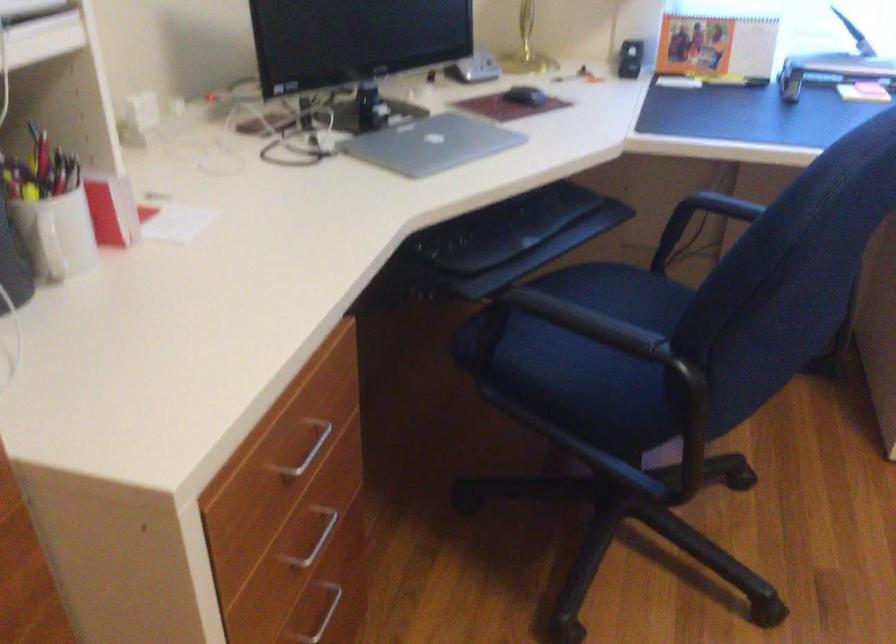
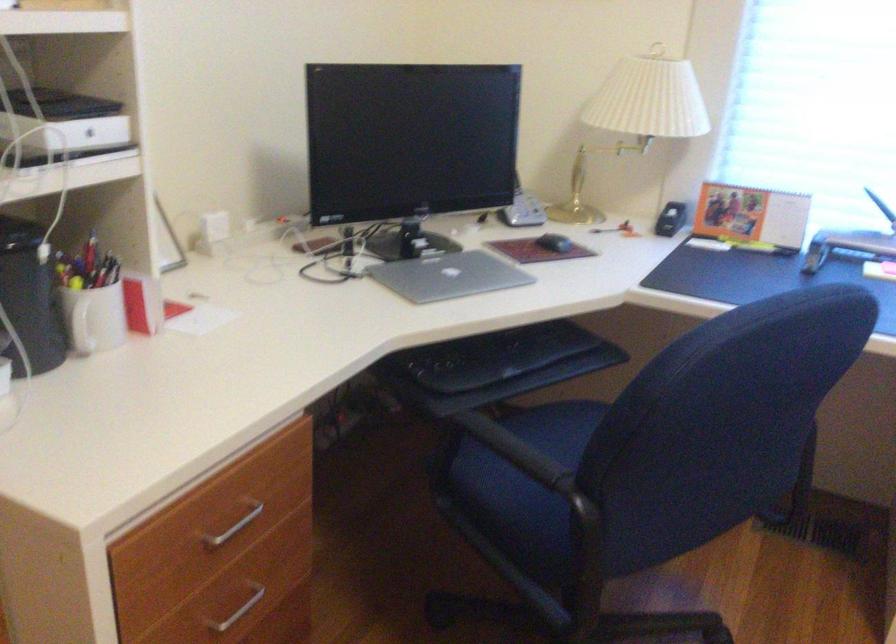
In the second image, find the point that corresponds to point (302, 462) in the first image.

(231, 527)